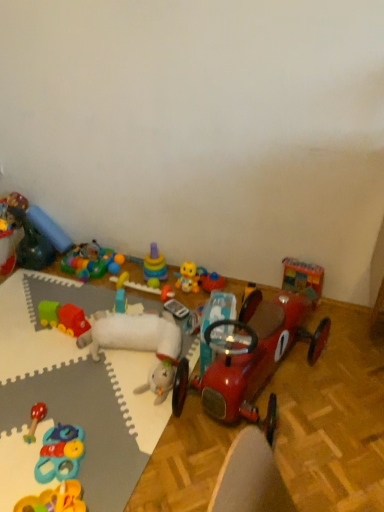
The height and width of the screenshot is (512, 384). What are the coordinates of `free space on the front side of shiny red car at center, marked as the eleventh toy in a left-to-right arrangement` in the screenshot? It's located at (276, 463).